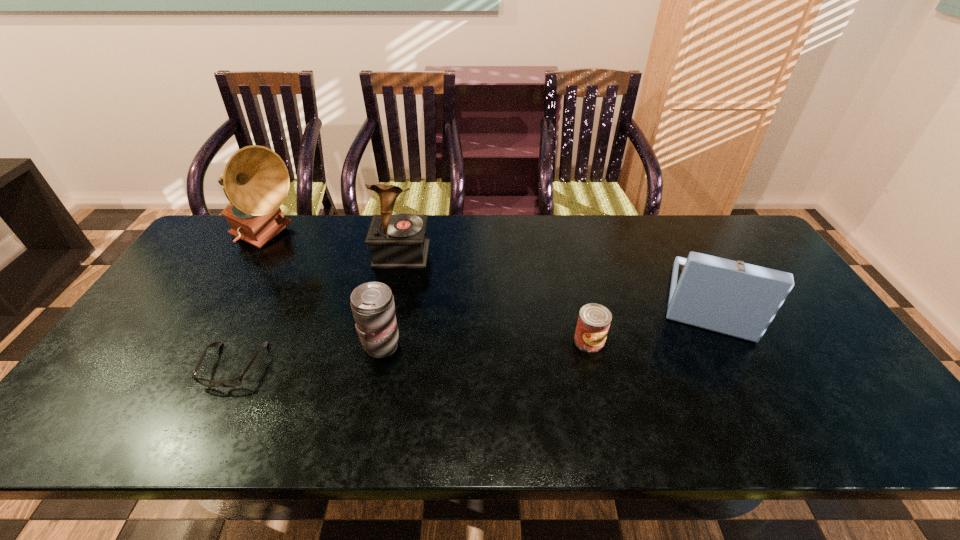
Where is `free space between the shortest object and the second phonograph record from right to left`? This screenshot has height=540, width=960. free space between the shortest object and the second phonograph record from right to left is located at coordinates (318, 310).

The height and width of the screenshot is (540, 960). I want to click on vacant space that's between the spectacles and the shortest phonograph record, so click(x=472, y=333).

Where is `free area in between the fifth tallest object and the second tallest object`? The height and width of the screenshot is (540, 960). free area in between the fifth tallest object and the second tallest object is located at coordinates (495, 297).

You are a GUI agent. You are given a task and a screenshot of the screen. Output one action in this format:
    pyautogui.click(x=<x>, y=<y>)
    Task: Click on the vacant area between the fifth shortest object and the tallest phonograph record
    
    Given the screenshot: What is the action you would take?
    pyautogui.click(x=334, y=247)

What are the coordinates of `object that stands as the third closest to the leftmost phonograph record` in the screenshot? It's located at (372, 303).

I want to click on object that is the fifth closest to the second shortest object, so click(256, 181).

The width and height of the screenshot is (960, 540). I want to click on phonograph record that can be found as the second closest to the leftmost phonograph record, so click(734, 298).

Choose which phonograph record is the second nearest neighbor to the shortest object. Please provide its 2D coordinates. Your answer should be formatted as a tuple, i.e. [(x, y)], where the tuple contains the x and y coordinates of a point satisfying the conditions above.

[(396, 241)]

Locate an element on the screen. Image resolution: width=960 pixels, height=540 pixels. free location that satisfies the following two spatial constraints: 1. on the side of the telephoto lens where the control switches are located; 2. on the front-facing side of the spectacles is located at coordinates (378, 366).

Locate an element on the screen. The height and width of the screenshot is (540, 960). vacant point that satisfies the following two spatial constraints: 1. on the horn of the rightmost object; 2. on the right side of the tallest object is located at coordinates (229, 301).